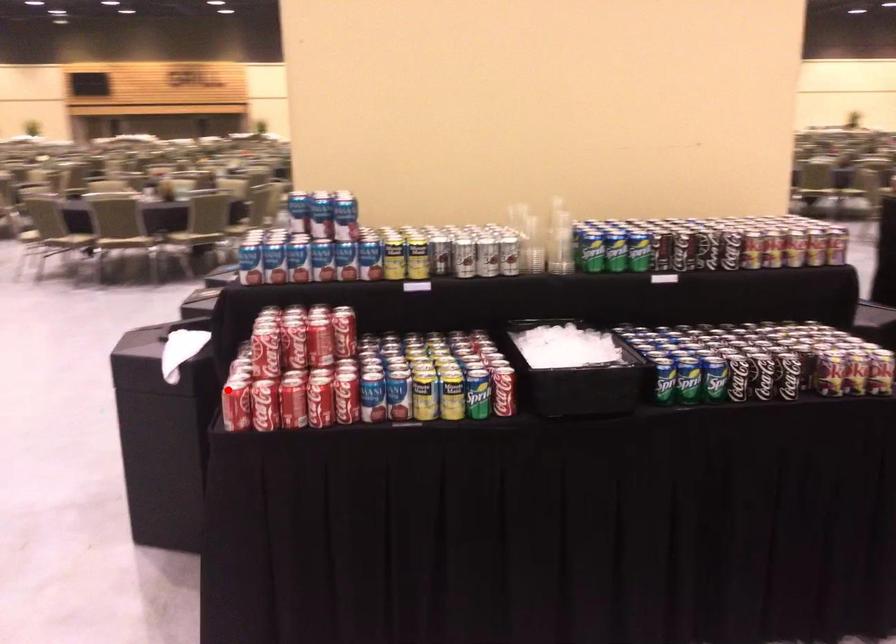
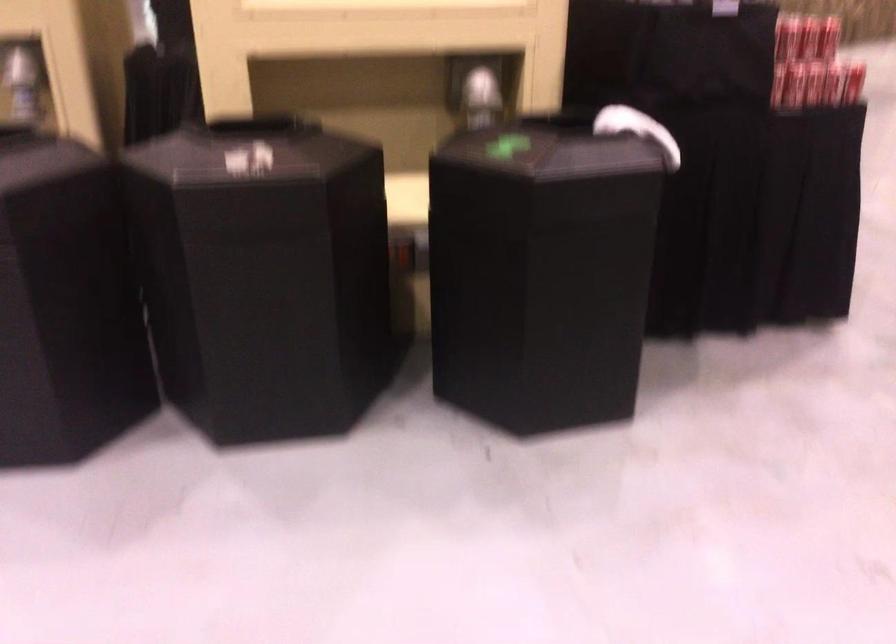
Where in the second image is the point corresponding to the highlighted location from the first image?

(833, 84)